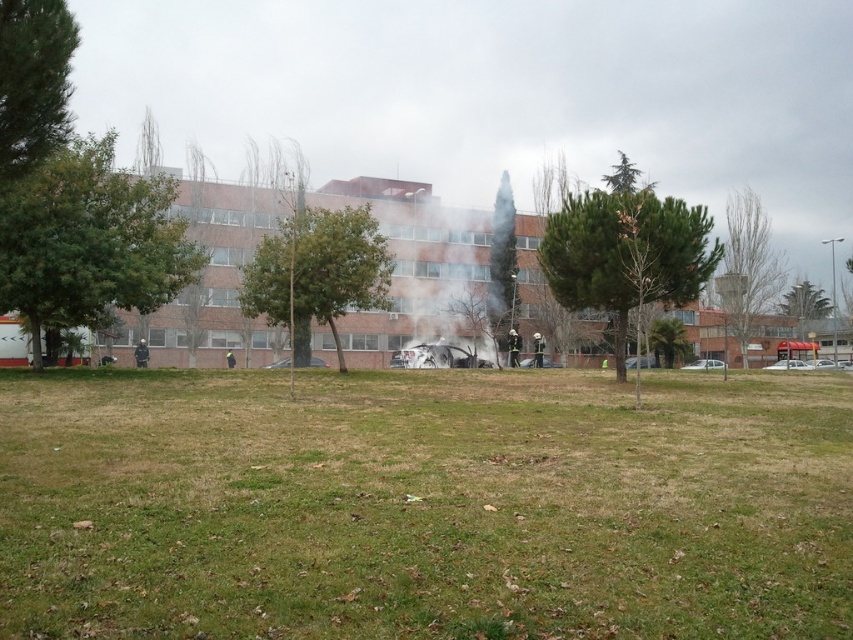
You are a firefighter trying to reach the fire in the vehicle near the building. You see the green textured tree at center and the green leafy tree at upper center. Which tree is closer to the fire?

The green textured tree at center is closer to the fire because it is positioned on the left side of the green leafy tree at upper center, which is further away from the fire location near the building.

You are standing in front of the building and want to move towards the green leafy tree at upper left. Which direction should you walk to avoid stepping on the green grass at center?

The green grass at center is closer to you than the green leafy tree at upper left, so you should walk around the green grass at center to reach the green leafy tree at upper left without stepping on it.